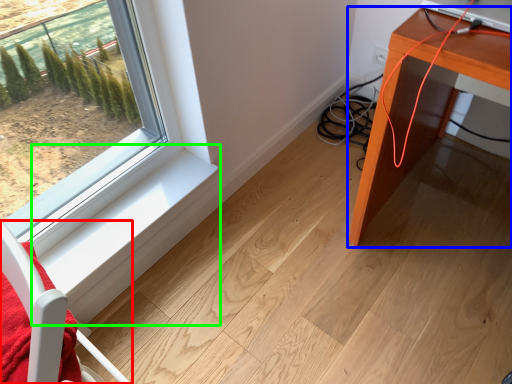
Question: Estimate the real-world distances between objects in this image. Which object is farther from furniture (highlighted by a red box), table (highlighted by a blue box) or window sill (highlighted by a green box)?

Choices:
 (A) table
 (B) window sill

Answer: (A)